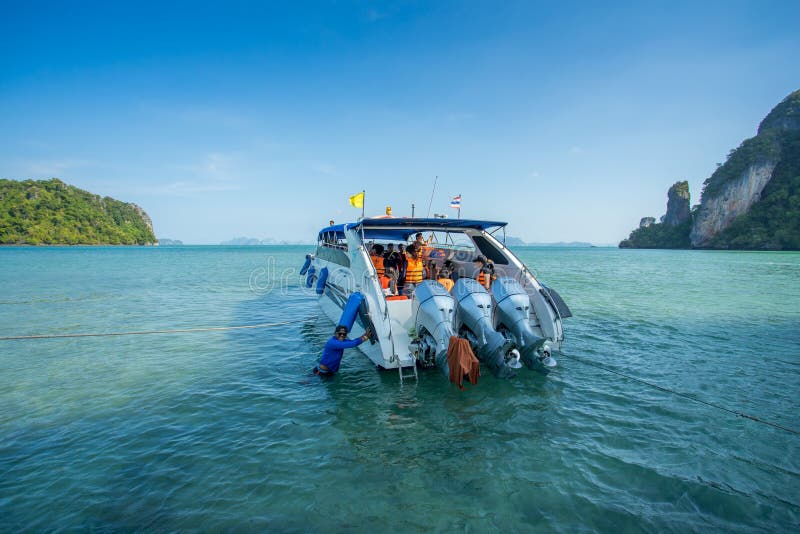
Locate an element on the screen. towel is located at coordinates (462, 358).